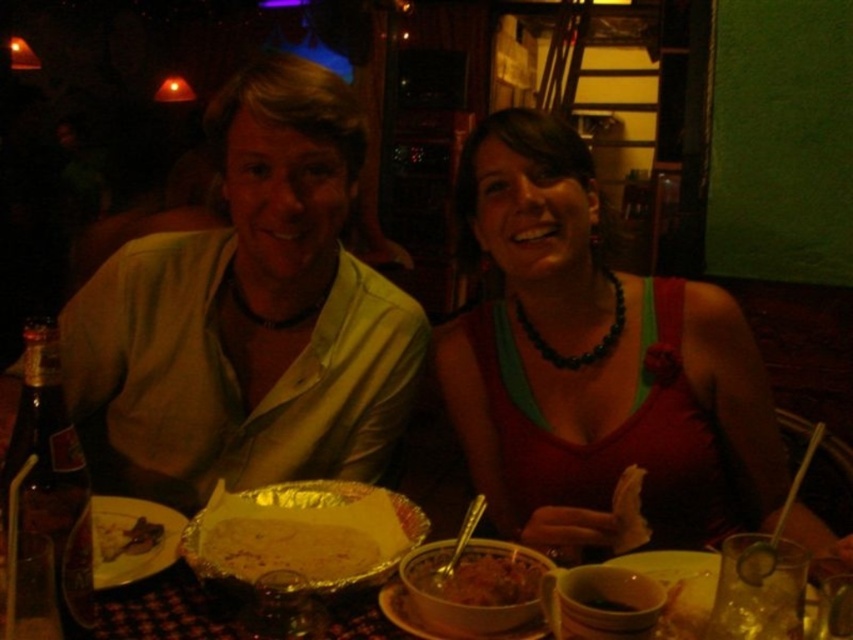
Question: In this image, where is shiny aluminum foil at center located relative to shiny metallic bowl at center?

Choices:
 (A) right
 (B) left

Answer: (B)

Question: Which object is positioned closest to the silver foil platter at lower left?

Choices:
 (A) shiny aluminum foil at center
 (B) matte red tank top at center
 (C) shiny metallic bowl at center

Answer: (A)

Question: Considering the relative positions of matte red tank top at center and silver foil platter at lower left in the image provided, where is matte red tank top at center located with respect to silver foil platter at lower left?

Choices:
 (A) right
 (B) left

Answer: (A)

Question: Which point is closer to the camera taking this photo?

Choices:
 (A) (155, 518)
 (B) (158, 534)

Answer: (B)

Question: Does matte red tank top at center appear on the left side of brown crispy meat at lower left?

Choices:
 (A) no
 (B) yes

Answer: (A)

Question: Which point is farther to the camera?

Choices:
 (A) (529, 572)
 (B) (253, 525)
 (C) (173, 529)

Answer: (C)